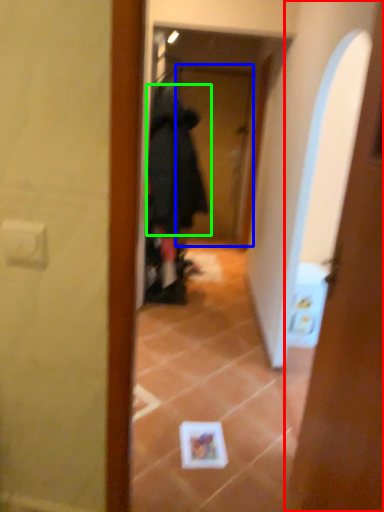
Question: Which object is the closest to the door (highlighted by a red box)? Choose among these: screen door (highlighted by a blue box) or bathrobe (highlighted by a green box).

Choices:
 (A) screen door
 (B) bathrobe

Answer: (B)